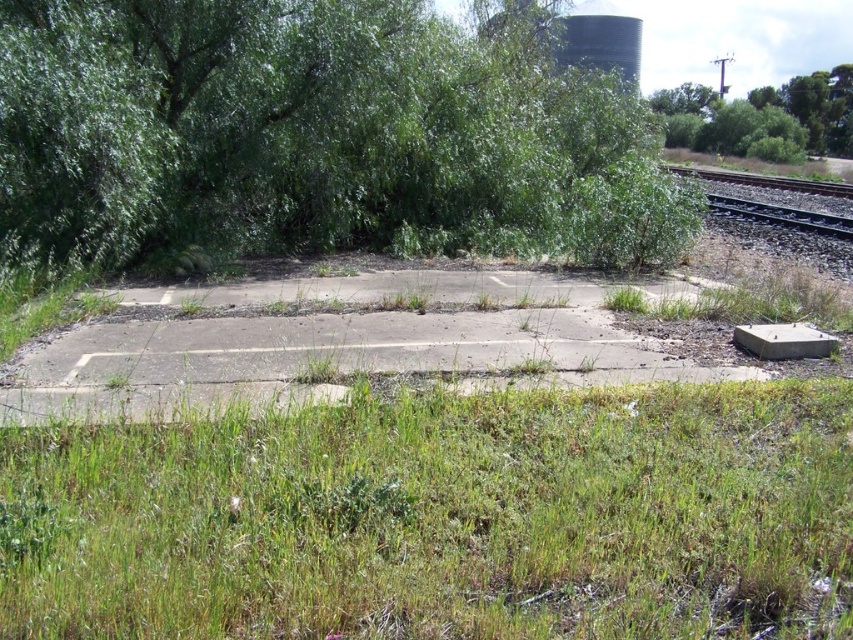
Can you confirm if green grass at lower center is smaller than green leafy tree at upper right?

Indeed, green grass at lower center has a smaller size compared to green leafy tree at upper right.

Is point (364, 532) positioned in front of point (839, 81)?

Yes.

You are a GUI agent. You are given a task and a screenshot of the screen. Output one action in this format:
    pyautogui.click(x=<x>, y=<y>)
    Task: Click on the green grass at lower center
    Image resolution: width=853 pixels, height=640 pixels.
    Given the screenshot: What is the action you would take?
    pyautogui.click(x=440, y=518)

Is green grass at lower center positioned at the back of green leafy tree at upper left?

No, it is in front of green leafy tree at upper left.

Can you confirm if green grass at lower center is positioned to the left of green leafy tree at upper left?

Correct, you'll find green grass at lower center to the left of green leafy tree at upper left.

Does point (677, 609) come closer to viewer compared to point (461, 33)?

Yes, point (677, 609) is closer to viewer.

The width and height of the screenshot is (853, 640). What are the coordinates of `green grass at lower center` in the screenshot? It's located at (440, 518).

Is point (556, 138) positioned after point (717, 97)?

That is False.

Is green leafy tree at upper left closer to the viewer compared to green leafy tree at upper right?

That is True.

Is point (538, 204) positioned before point (779, 129)?

Yes, it is in front of point (779, 129).

Find the location of a particular element. The image size is (853, 640). green leafy tree at upper left is located at coordinates pyautogui.click(x=314, y=134).